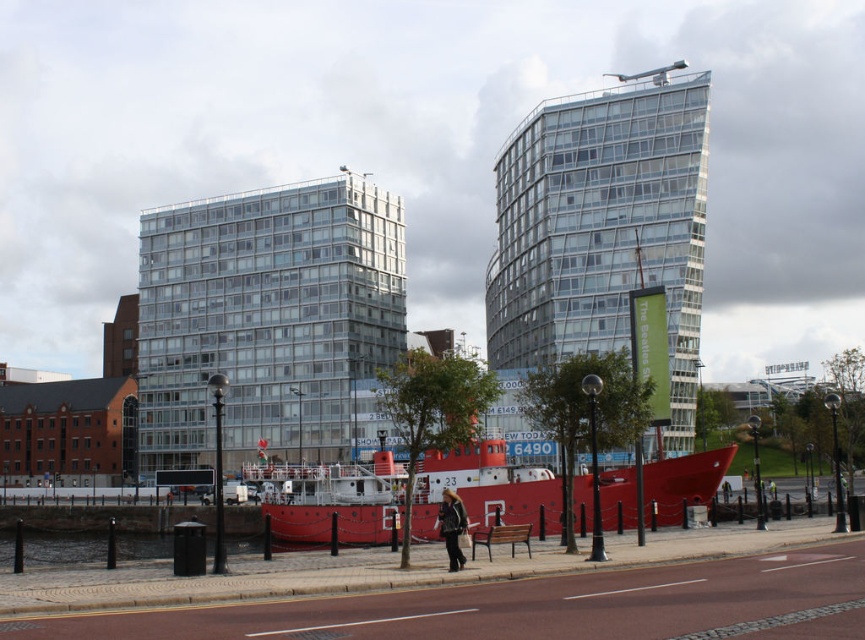
You are a photographer planning to capture the entire view of both the transparent glass building at upper center and the metallic red boat at center in a single shot. Based on their sizes, which object should you position closer to the camera to ensure both fit in the frame?

Since the transparent glass building at upper center is wider than the metallic red boat at center, you should position the metallic red boat at center closer to the camera to ensure both fit in the frame.

From the picture: You are a crane operator trying to lift a container from the metallic red boat at center. The container is 10 meters tall. Can you safely lift it without hitting the transparent glass building at upper center?

The transparent glass building at upper center is taller than the metallic red boat at center. Since the container is 10 meters tall, and the building is taller than the boat, it is possible that the building might be higher than the container. However, without knowing the exact height of the building, it is uncertain whether the container can be lifted safely. Please check the building height before proceeding.

You are standing on the pier next to the metallic red boat at center. You want to take a photo of the glassy reflective building at center without any obstructions. Is there enough space between you and the building to avoid the boat blocking the view?

The glassy reflective building at center is taller than the metallic red boat at center, so there should be enough vertical space to take a photo without the boat blocking the view.